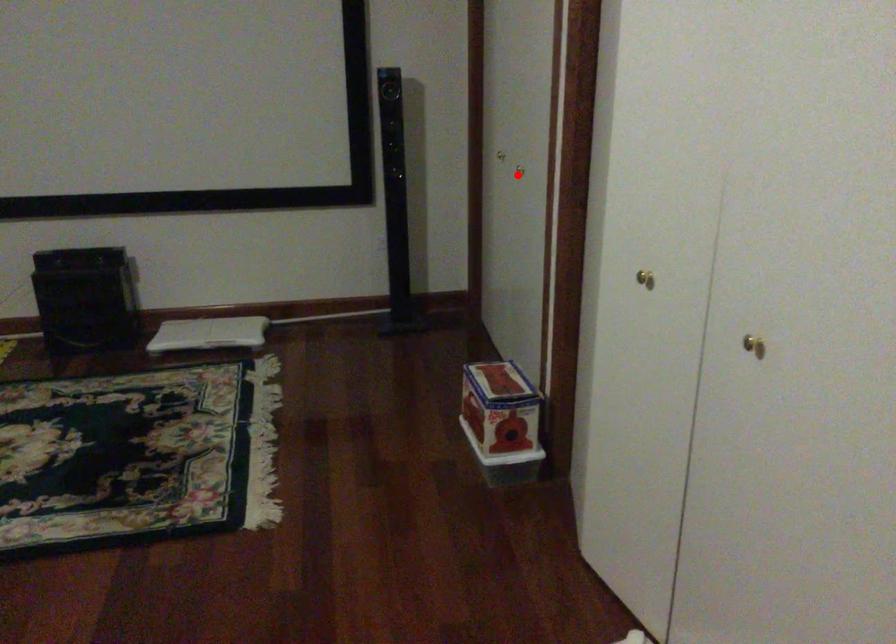
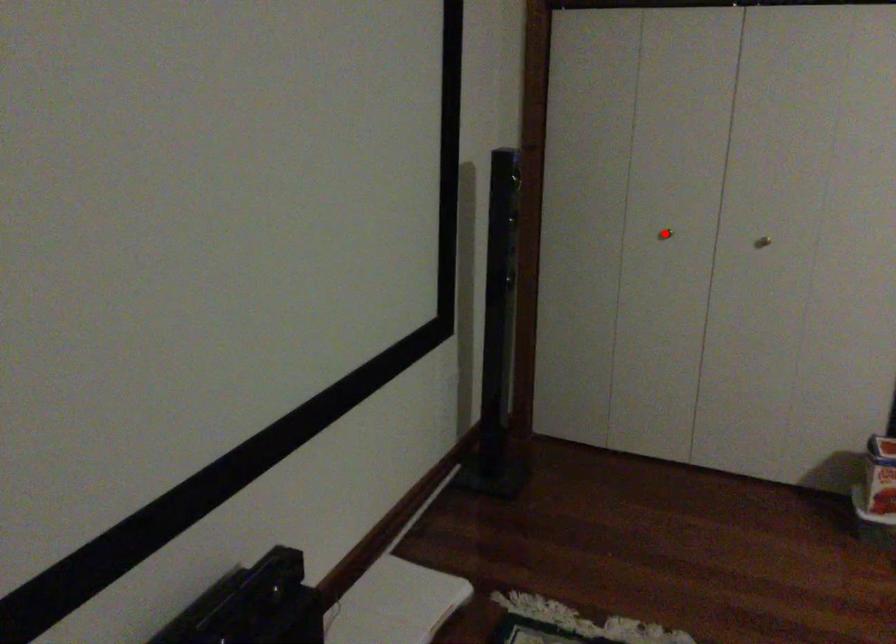
I am providing you with two images of the same scene from different viewpoints. A red point is marked on the first image and another point is marked on the second image. Do the highlighted points in image1 and image2 indicate the same real-world spot?

No